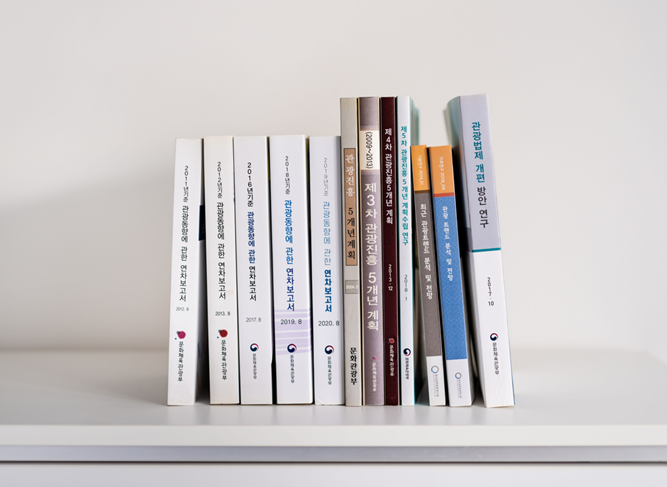
Where is `white binded books`? The height and width of the screenshot is (487, 667). white binded books is located at coordinates (185, 268), (213, 288), (251, 292), (293, 298), (321, 298).